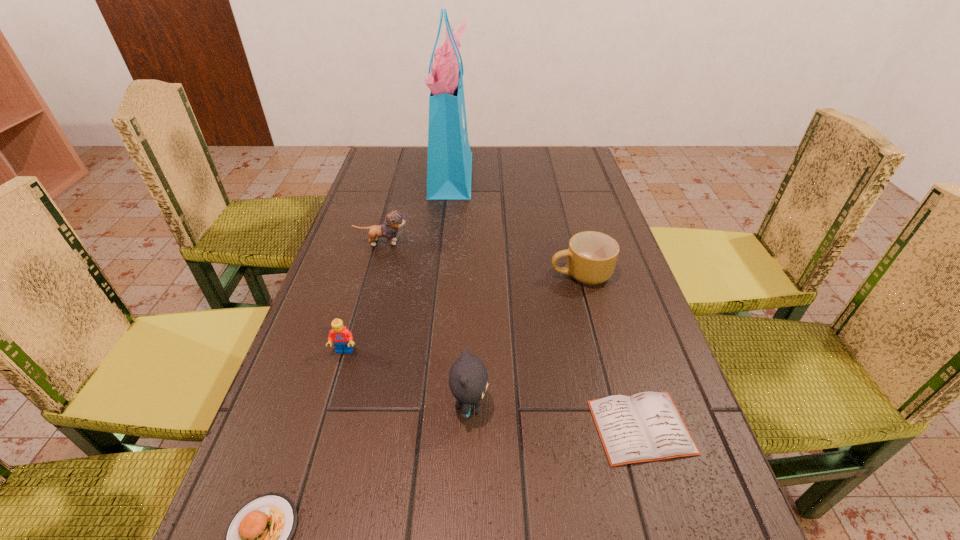
Find the location of a particular element. This screenshot has width=960, height=540. blank space located 0.160m on the front-facing side of the right kitten is located at coordinates (576, 406).

Where is `vacant space located 0.330m on the front-facing side of the farther kitten`? vacant space located 0.330m on the front-facing side of the farther kitten is located at coordinates (533, 243).

The image size is (960, 540). In order to click on vacant space located on the side with the handle of the fifth nearest object in this screenshot , I will do `click(471, 274)`.

I want to click on free region located on the side with the handle of the fifth nearest object, so click(x=528, y=274).

Identify the location of vacant space located on the side with the handle of the fifth nearest object. The width and height of the screenshot is (960, 540). (443, 274).

Locate an element on the screen. The width and height of the screenshot is (960, 540). vacant space located on the face of the Lego is located at coordinates (299, 508).

I want to click on vacant area situated on the left of the diary, so click(541, 427).

Where is `object that is at the far edge`? The image size is (960, 540). object that is at the far edge is located at coordinates (449, 164).

Find the location of a particular element. This screenshot has width=960, height=540. kitten located at the left edge is located at coordinates (394, 219).

Find the location of `Lego present at the left edge`. Lego present at the left edge is located at coordinates (342, 338).